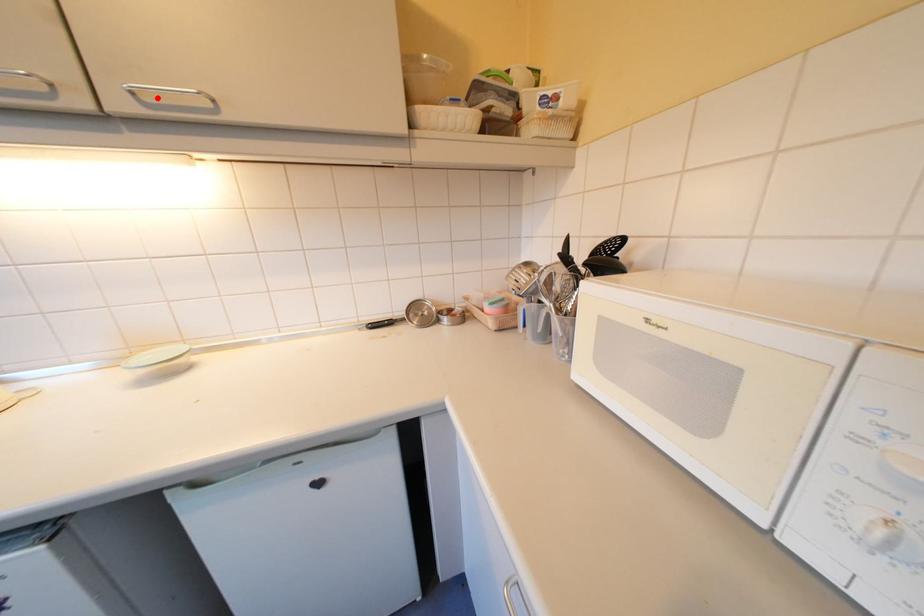
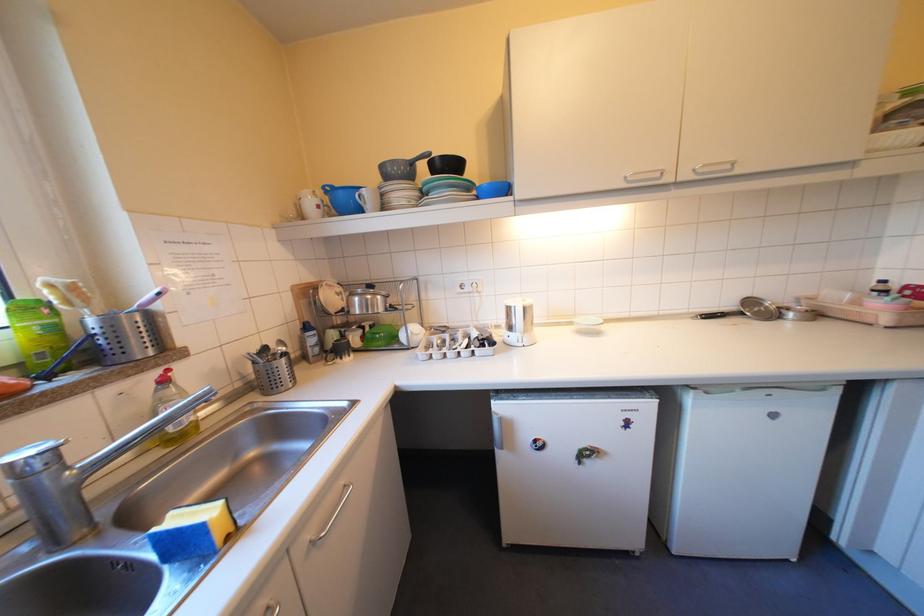
In the second image, find the point that corresponds to the highlighted location in the first image.

(712, 169)